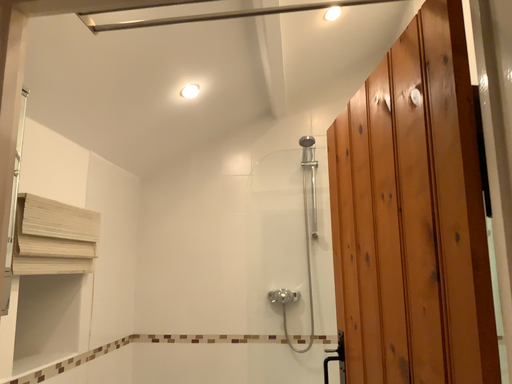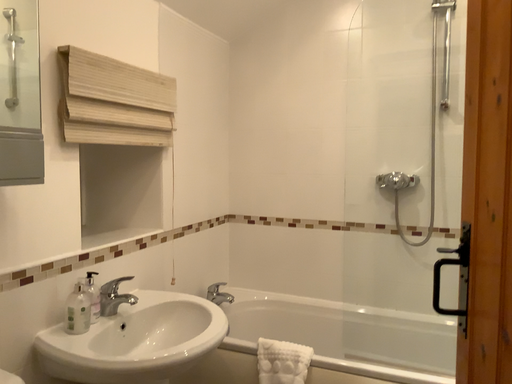
Question: How did the camera likely rotate when shooting the video?

Choices:
 (A) rotated downward
 (B) rotated upward

Answer: (A)